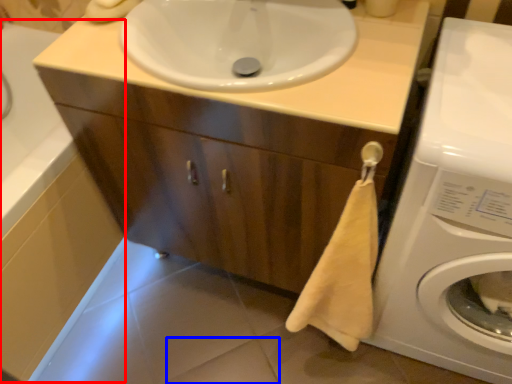
Question: Which of the following is the farthest to the observer, bath (highlighted by a red box) or tile (highlighted by a blue box)?

Choices:
 (A) bath
 (B) tile

Answer: (B)